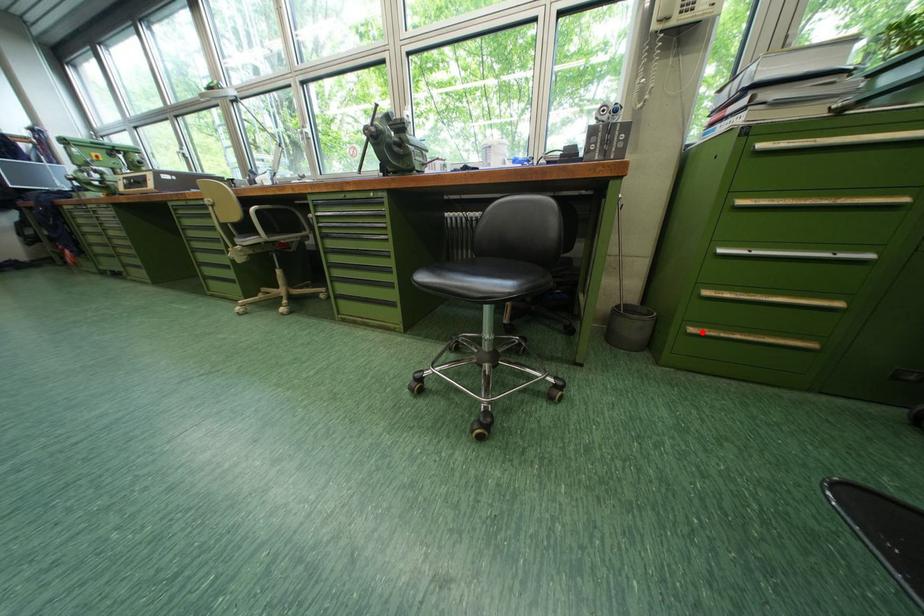
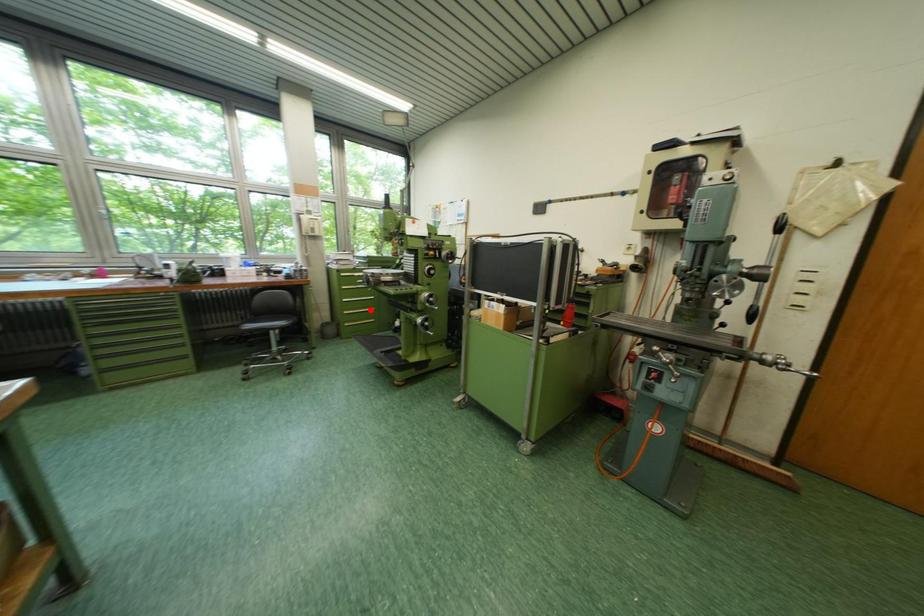
I am providing you with two images of the same scene from different viewpoints. A red point is marked on the first image and another point is marked on the second image. Is the marked point in image1 the same physical position as the marked point in image2?

No